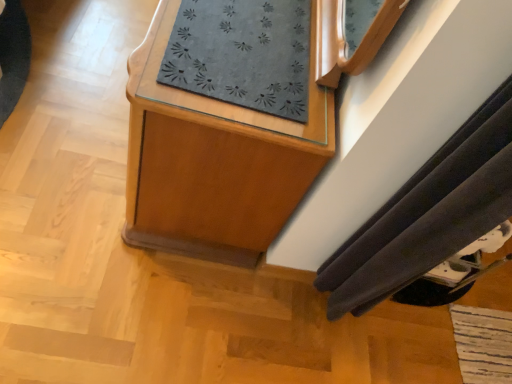
Where is `wooden cabinet at center`? The image size is (512, 384). wooden cabinet at center is located at coordinates (230, 147).

Describe the element at coordinates (230, 147) in the screenshot. Image resolution: width=512 pixels, height=384 pixels. I see `wooden cabinet at center` at that location.

This screenshot has width=512, height=384. In order to click on wooden cabinet at center in this screenshot , I will do pyautogui.click(x=230, y=147).